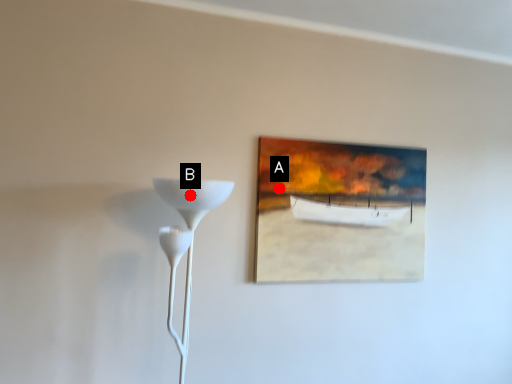
Question: Two points are circled on the image, labeled by A and B beside each circle. Among these points, which one is farthest from the camera?

Choices:
 (A) A is further
 (B) B is further

Answer: (A)